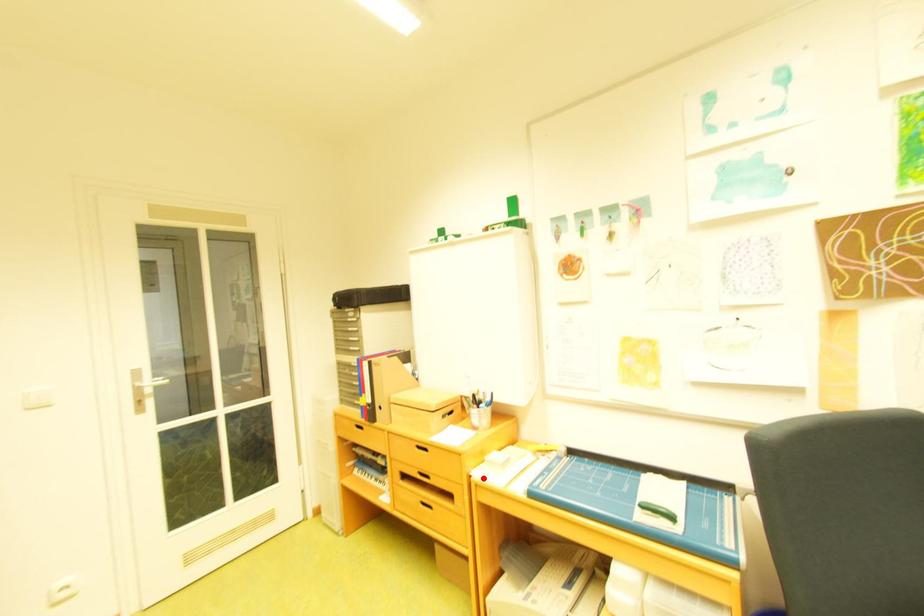
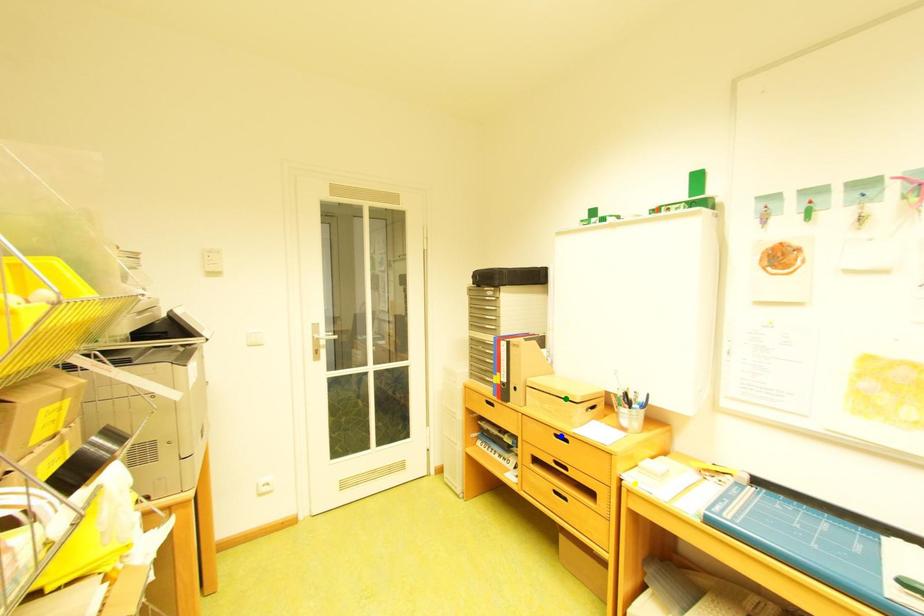
Question: I am providing you with two images of the same scene from different viewpoints. A red point is marked on the first image. You are given multiple points on the second image. Which spot in image 2 lines up with the point in image 1?

Choices:
 (A) green point
 (B) yellow point
 (C) blue point

Answer: (B)